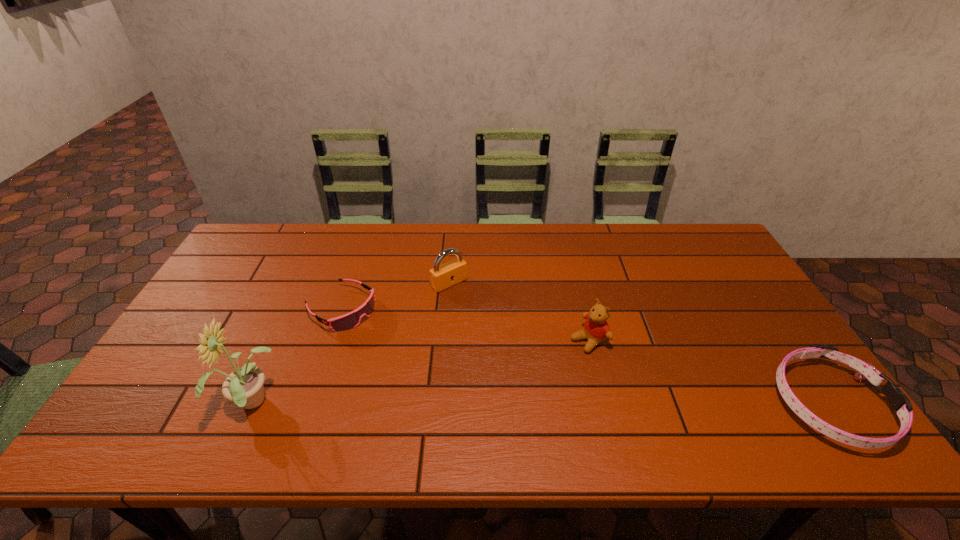
Where is `vacant space that satisfies the following two spatial constraints: 1. on the front side of the dog collar; 2. with the buckle on the goggles`? vacant space that satisfies the following two spatial constraints: 1. on the front side of the dog collar; 2. with the buckle on the goggles is located at coordinates (309, 404).

You are a GUI agent. You are given a task and a screenshot of the screen. Output one action in this format:
    pyautogui.click(x=<x>, y=<y>)
    Task: Click on the vacant space that satisfies the following two spatial constraints: 1. on the front side of the fourth object from left to right; 2. with the buckle on the rightmost object
    
    Given the screenshot: What is the action you would take?
    (x=605, y=404)

The width and height of the screenshot is (960, 540). I want to click on free point that satisfies the following two spatial constraints: 1. on the front side of the third object from right to left; 2. with the buckle on the rightmost object, so click(x=440, y=404).

Where is `vacant area that satisfies the following two spatial constraints: 1. on the front side of the fourth object from left to right; 2. with the buckle on the dog collar`? This screenshot has width=960, height=540. vacant area that satisfies the following two spatial constraints: 1. on the front side of the fourth object from left to right; 2. with the buckle on the dog collar is located at coordinates (605, 404).